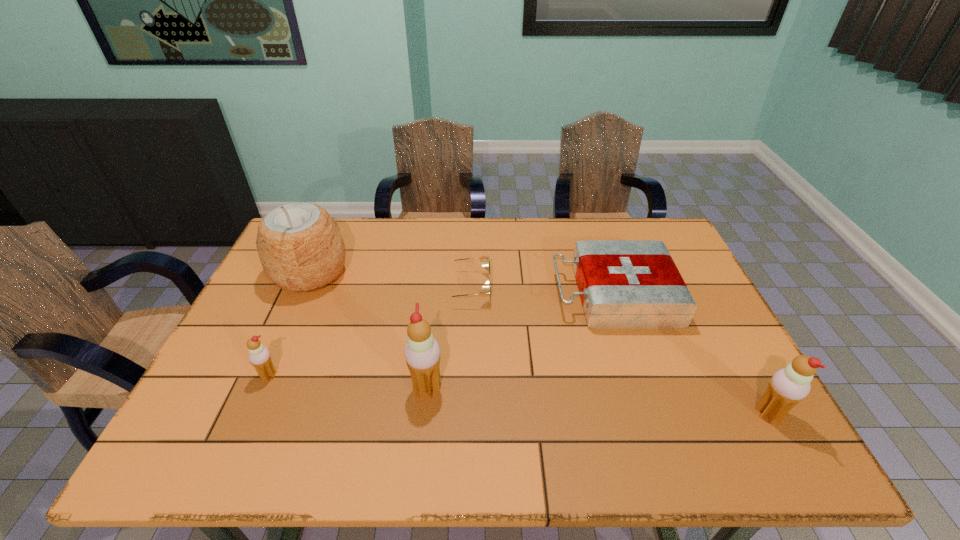
Select which object appears as the third closest to the second icecream from right to left. Please provide its 2D coordinates. Your answer should be formatted as a tuple, i.e. [(x, y)], where the tuple contains the x and y coordinates of a point satisfying the conditions above.

[(624, 284)]

Locate an element on the screen. Image resolution: width=960 pixels, height=540 pixels. the third closest object to the second icecream from right to left is located at coordinates (624, 284).

Locate which icecream is the closest to the leftmost icecream. Please provide its 2D coordinates. Your answer should be formatted as a tuple, i.e. [(x, y)], where the tuple contains the x and y coordinates of a point satisfying the conditions above.

[(422, 352)]

Identify the location of icecream object that ranks as the closest to the shortest object. (422, 352).

I want to click on vacant space that satisfies the following two spatial constraints: 1. on the front side of the fifth object from left to right; 2. at the front with a straw on the leftmost icecream, so (x=640, y=375).